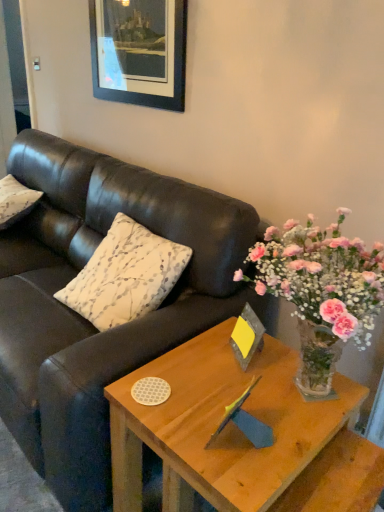
What are the coordinates of `vacant space to the right of wooden block with yellow card at center, positioned as the first picture frame in bottom-to-top order` in the screenshot? It's located at (288, 362).